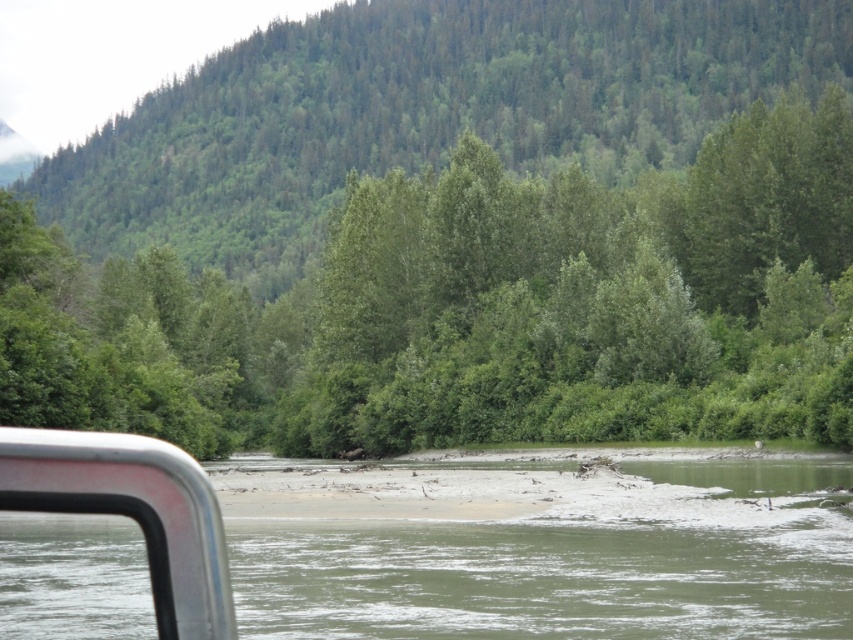
Question: Is green leafy forest at upper center bigger than greenish-brown sediment at center?

Choices:
 (A) no
 (B) yes

Answer: (B)

Question: Which point is closer to the camera taking this photo?

Choices:
 (A) (473, 138)
 (B) (140, 625)

Answer: (B)

Question: Observing the image, what is the correct spatial positioning of green leafy forest at upper center in reference to greenish-brown sediment at center?

Choices:
 (A) below
 (B) above

Answer: (B)

Question: Is green leafy forest at upper center above greenish-brown sediment at center?

Choices:
 (A) yes
 (B) no

Answer: (A)

Question: Which of the following is the farthest from the observer?

Choices:
 (A) greenish-brown sediment at center
 (B) green leafy forest at upper center

Answer: (B)